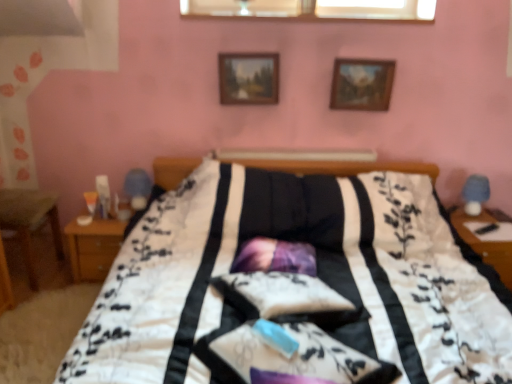
Question: From the image's perspective, is wooden nightstand at left above or below transparent glass window at upper center?

Choices:
 (A) above
 (B) below

Answer: (B)

Question: Is wooden nightstand at left in front of or behind transparent glass window at upper center in the image?

Choices:
 (A) front
 (B) behind

Answer: (A)

Question: Based on their relative distances, which object is farther from the transparent glass window at upper center?

Choices:
 (A) blue fabric table lamp at right
 (B) wooden nightstand at left
 (C) wooden picture frame at upper center, arranged as the 2th picture frame when viewed from the left
 (D) purple satin pillow at center
 (E) wooden picture frame at upper center, the second picture frame when ordered from right to left

Answer: (B)

Question: Based on their relative distances, which object is nearer to the wooden picture frame at upper center, arranged as the 1th picture frame when viewed from the right?

Choices:
 (A) wooden nightstand at right
 (B) wooden nightstand at left
 (C) transparent glass window at upper center
 (D) wooden picture frame at upper center, which is counted as the 1th picture frame, starting from the left
 (E) purple satin pillow at center

Answer: (C)